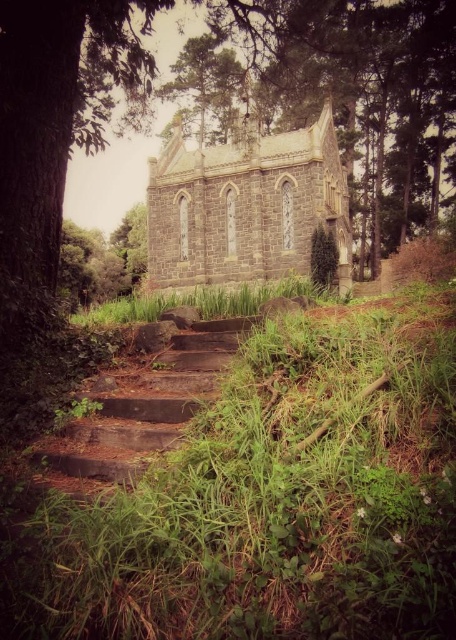
Question: Does dark gray stone church at center have a greater width compared to green textured pine tree at upper center?

Choices:
 (A) no
 (B) yes

Answer: (B)

Question: Is green grassy steps at center positioned behind green textured pine tree at upper center?

Choices:
 (A) yes
 (B) no

Answer: (B)

Question: Which object appears closest to the camera in this image?

Choices:
 (A) dark gray stone church at center
 (B) green textured pine tree at upper center
 (C) green grassy steps at center

Answer: (C)

Question: Among these objects, which one is farthest from the camera?

Choices:
 (A) green textured pine tree at upper center
 (B) green grassy steps at center

Answer: (A)

Question: Which point is closer to the camera?

Choices:
 (A) (171, 636)
 (B) (176, 60)
 (C) (159, 225)

Answer: (A)

Question: Is dark gray stone church at center wider than green textured pine tree at upper center?

Choices:
 (A) no
 (B) yes

Answer: (B)